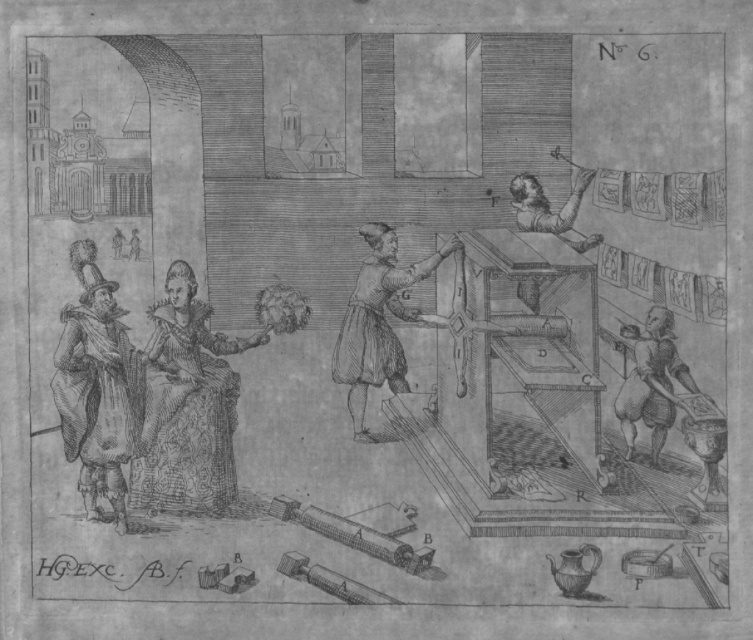
Question: Observing the image, what is the correct spatial positioning of smooth fabric dress at center in reference to brown paper hat at center?

Choices:
 (A) above
 (B) below

Answer: (B)

Question: Among these points, which one is farthest from the camera?

Choices:
 (A) (203, 492)
 (B) (107, 369)

Answer: (B)

Question: Is the position of smooth fabric dress at center less distant than that of smooth gray hat at left?

Choices:
 (A) no
 (B) yes

Answer: (B)

Question: Which object is the farthest from the smooth fabric dress at center?

Choices:
 (A) smooth gray hat at left
 (B) brown paper hat at center

Answer: (B)

Question: Does smooth fabric dress at center appear on the left side of brown paper hat at center?

Choices:
 (A) yes
 (B) no

Answer: (A)

Question: Which point is farther to the camera?

Choices:
 (A) (230, 433)
 (B) (364, 387)

Answer: (B)